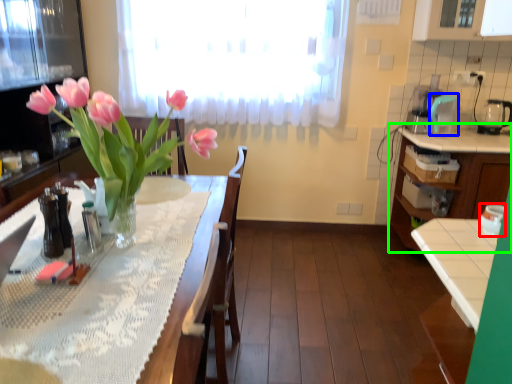
Question: Which is farther away from appliance (highlighted by a red box)? appliance (highlighted by a blue box) or cabinetry (highlighted by a green box)?

Choices:
 (A) appliance
 (B) cabinetry

Answer: (A)